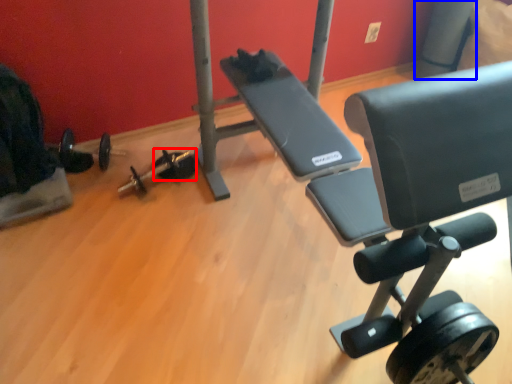
Question: Among these objects, which one is nearest to the camera, dumbbell (highlighted by a red box) or pole (highlighted by a blue box)?

Choices:
 (A) dumbbell
 (B) pole

Answer: (A)